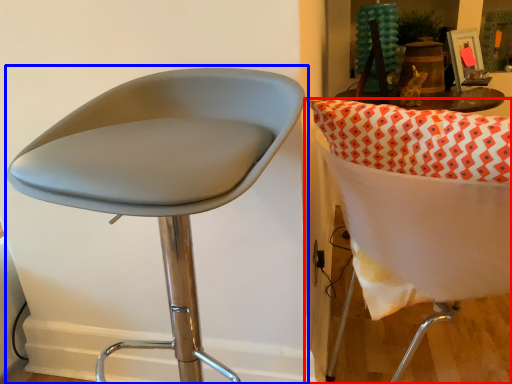
Question: Which of the following is the farthest to the observer, chair (highlighted by a red box) or chair (highlighted by a blue box)?

Choices:
 (A) chair
 (B) chair

Answer: (A)